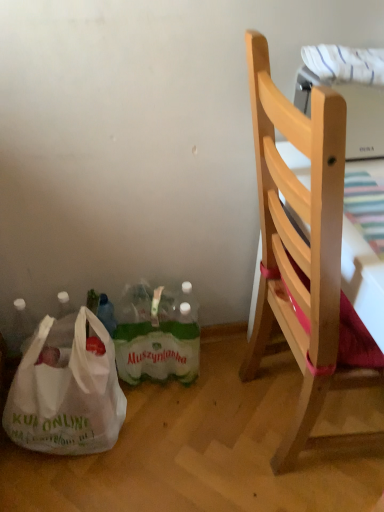
Question: Are natural wood chair at right and white plastic bag at lower left making contact?

Choices:
 (A) no
 (B) yes

Answer: (A)

Question: Is natural wood chair at right shorter than white plastic bag at lower left?

Choices:
 (A) yes
 (B) no

Answer: (B)

Question: Would you say natural wood chair at right is a long distance from white plastic bag at lower left?

Choices:
 (A) no
 (B) yes

Answer: (A)

Question: Considering the relative sizes of natural wood chair at right and white plastic bag at lower left in the image provided, is natural wood chair at right wider than white plastic bag at lower left?

Choices:
 (A) yes
 (B) no

Answer: (A)

Question: Is natural wood chair at right thinner than white plastic bag at lower left?

Choices:
 (A) no
 (B) yes

Answer: (A)

Question: From the image's perspective, is green plastic bottles at lower center positioned above or below white plastic bag at lower left?

Choices:
 (A) below
 (B) above

Answer: (B)

Question: Considering the positions of green plastic bottles at lower center and white plastic bag at lower left in the image, is green plastic bottles at lower center taller or shorter than white plastic bag at lower left?

Choices:
 (A) short
 (B) tall

Answer: (A)

Question: From a real-world perspective, is green plastic bottles at lower center physically located above or below white plastic bag at lower left?

Choices:
 (A) below
 (B) above

Answer: (A)

Question: Looking at their shapes, would you say green plastic bottles at lower center is wider or thinner than white plastic bag at lower left?

Choices:
 (A) thin
 (B) wide

Answer: (A)

Question: In the image, is natural wood chair at right on the left side or the right side of green plastic bottles at lower center?

Choices:
 (A) left
 (B) right

Answer: (B)

Question: Based on their sizes in the image, would you say natural wood chair at right is bigger or smaller than green plastic bottles at lower center?

Choices:
 (A) big
 (B) small

Answer: (A)

Question: Is natural wood chair at right inside the boundaries of green plastic bottles at lower center, or outside?

Choices:
 (A) inside
 (B) outside

Answer: (B)

Question: From a real-world perspective, relative to green plastic bottles at lower center, is natural wood chair at right vertically above or below?

Choices:
 (A) below
 (B) above

Answer: (B)

Question: Do you think white plastic bag at lower left is within natural wood chair at right, or outside of it?

Choices:
 (A) inside
 (B) outside

Answer: (B)

Question: Based on their sizes in the image, would you say white plastic bag at lower left is bigger or smaller than natural wood chair at right?

Choices:
 (A) small
 (B) big

Answer: (A)